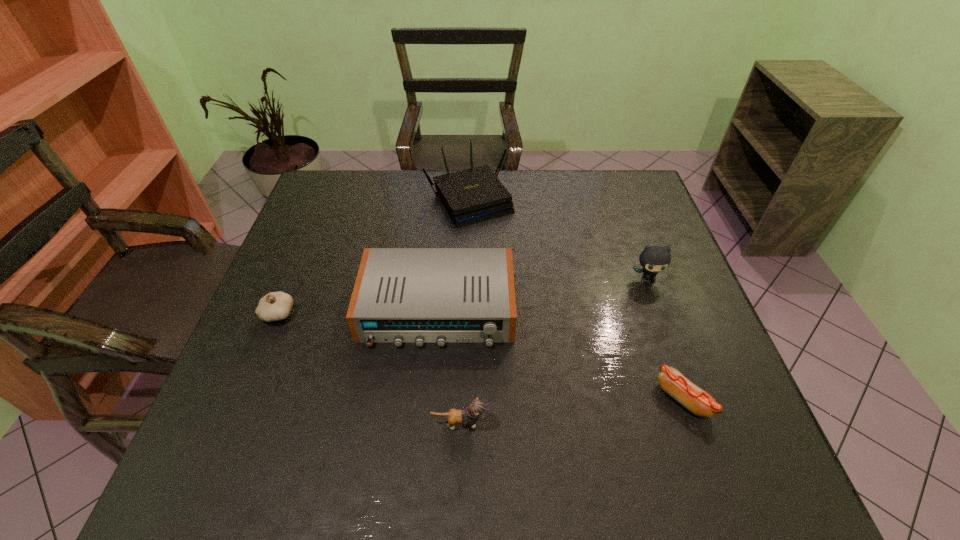
Locate an element on the screen. The image size is (960, 540). vacant area at the left edge of the desktop is located at coordinates (287, 252).

The image size is (960, 540). Find the location of `free space at the far left corner of the desktop`. free space at the far left corner of the desktop is located at coordinates (358, 200).

This screenshot has height=540, width=960. I want to click on vacant region at the far right corner of the desktop, so click(612, 209).

Where is `empty location between the farthest object and the farther kitten`? empty location between the farthest object and the farther kitten is located at coordinates (559, 239).

Locate an element on the screen. This screenshot has width=960, height=540. free area in between the shortest object and the farther kitten is located at coordinates (664, 339).

Locate an element on the screen. The width and height of the screenshot is (960, 540). free space between the taller kitten and the router is located at coordinates (559, 239).

Image resolution: width=960 pixels, height=540 pixels. What are the coordinates of `free area in between the sausage and the taller kitten` in the screenshot? It's located at (664, 339).

The height and width of the screenshot is (540, 960). What are the coordinates of `free spot between the shorter kitten and the radio receiver` in the screenshot? It's located at click(449, 366).

What are the coordinates of `free space between the farthest object and the sausage` in the screenshot? It's located at tap(576, 299).

Select which object appears as the second closest to the radio receiver. Please provide its 2D coordinates. Your answer should be formatted as a tuple, i.e. [(x, y)], where the tuple contains the x and y coordinates of a point satisfying the conditions above.

[(275, 306)]